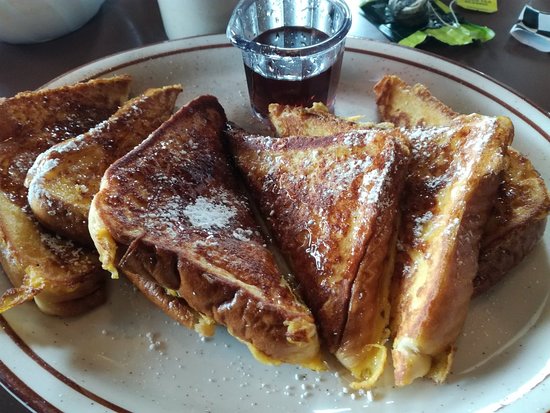
You are a GUI agent. You are given a task and a screenshot of the screen. Output one action in this format:
    pyautogui.click(x=<x>, y=<y>)
    Task: Click on the place to pour liquid out of dish
    The height and width of the screenshot is (413, 550).
    Given the screenshot: What is the action you would take?
    pyautogui.click(x=232, y=37)